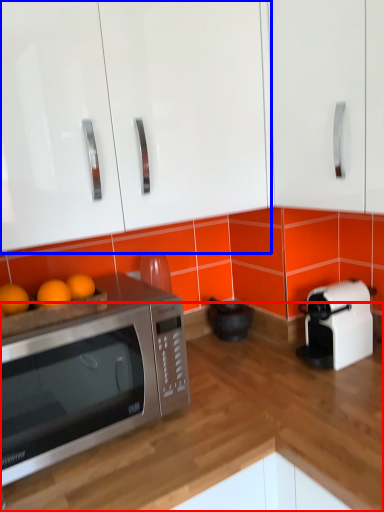
Question: Which point is closer to the camera, counter top (highlighted by a red box) or cabinetry (highlighted by a blue box)?

Choices:
 (A) counter top
 (B) cabinetry

Answer: (A)